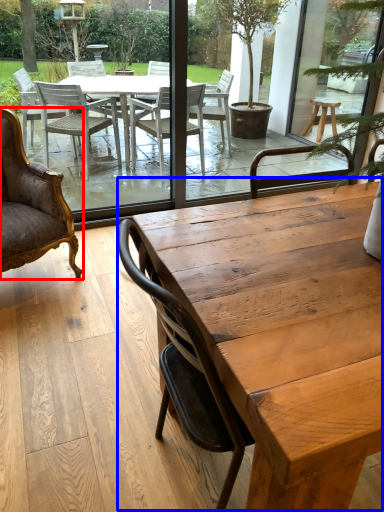
Question: Which object appears closest to the camera in this image, chair (highlighted by a red box) or coffee table (highlighted by a blue box)?

Choices:
 (A) chair
 (B) coffee table

Answer: (B)